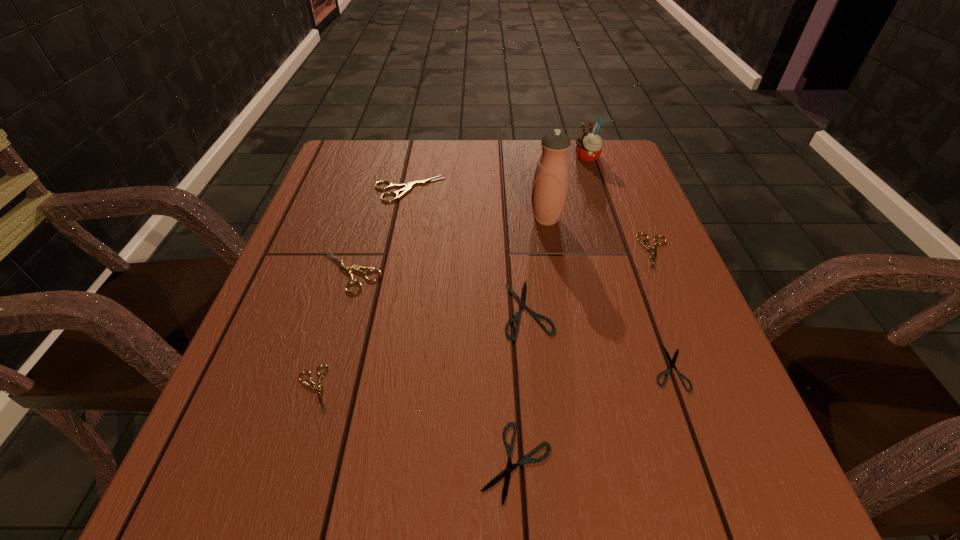
The image size is (960, 540). Identify the location of muffin situated at the right edge. (589, 145).

Locate an element on the screen. object that is at the far left corner is located at coordinates (407, 187).

Where is `object at the far right corner`? The width and height of the screenshot is (960, 540). object at the far right corner is located at coordinates (589, 145).

At what (x,y) coordinates should I click in order to perform the action: click on blank space at the far edge of the desktop. Please return your answer as a coordinate pair (x, y). The height and width of the screenshot is (540, 960). Looking at the image, I should click on point(437,144).

You are a GUI agent. You are given a task and a screenshot of the screen. Output one action in this format:
    pyautogui.click(x=<x>, y=<y>)
    Task: Click on the vacant space at the near edge
    
    Given the screenshot: What is the action you would take?
    (x=508, y=509)

Where is `free space at the left edge`? The width and height of the screenshot is (960, 540). free space at the left edge is located at coordinates (286, 451).

The width and height of the screenshot is (960, 540). I want to click on free space at the right edge of the desktop, so click(x=692, y=386).

The width and height of the screenshot is (960, 540). Find the location of `vacant area at the far left corner of the desktop`. vacant area at the far left corner of the desktop is located at coordinates (328, 171).

The width and height of the screenshot is (960, 540). In the image, there is a desktop. Find the location of `vacant space at the near left corner`. vacant space at the near left corner is located at coordinates (245, 464).

In the image, there is a desktop. At what (x,y) coordinates should I click in order to perform the action: click on vacant area at the far right corner. Please return your answer as a coordinate pair (x, y). This screenshot has width=960, height=540. Looking at the image, I should click on (574, 143).